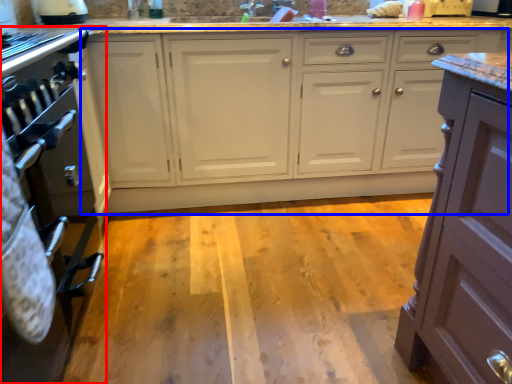
Question: Which object is closer to the camera taking this photo, home appliance (highlighted by a red box) or cabinetry (highlighted by a blue box)?

Choices:
 (A) home appliance
 (B) cabinetry

Answer: (A)